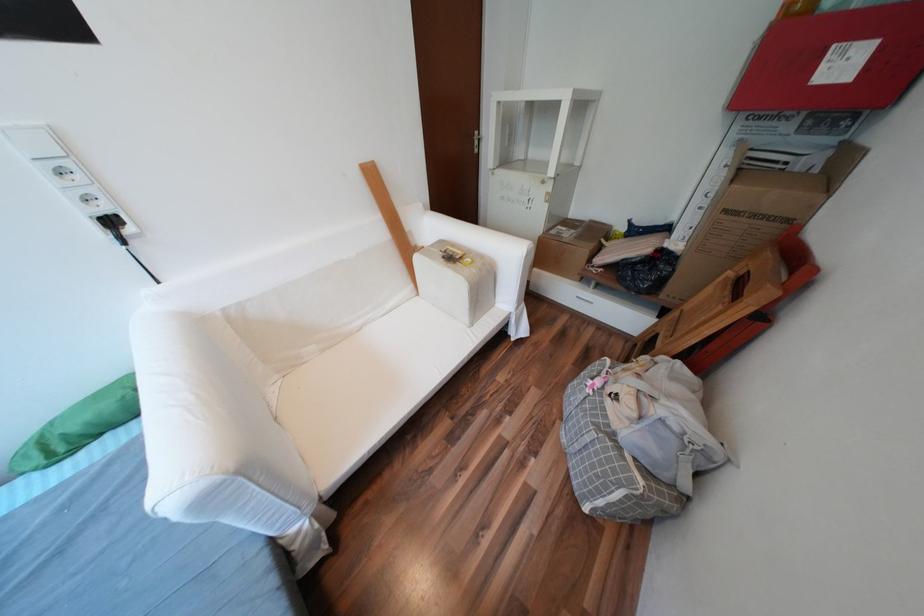
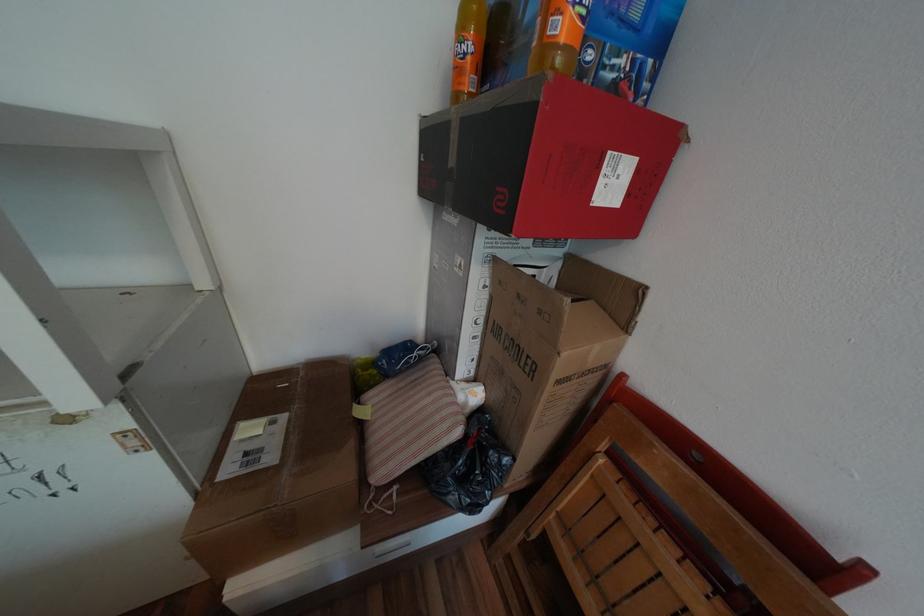
Where in the second image is the point corresponding to [581,232] from the first image?

(293, 416)